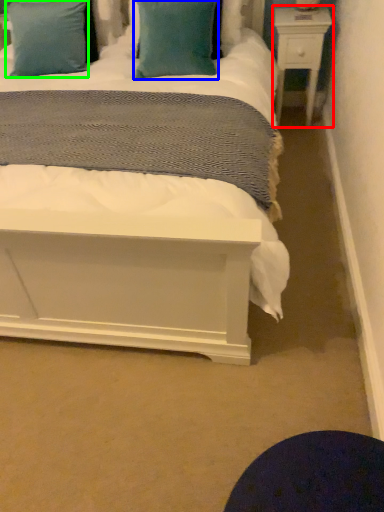
Question: Which object is positioned farthest from nightstand (highlighted by a red box)? Select from pillow (highlighted by a blue box) and pillow (highlighted by a green box).

Choices:
 (A) pillow
 (B) pillow

Answer: (B)